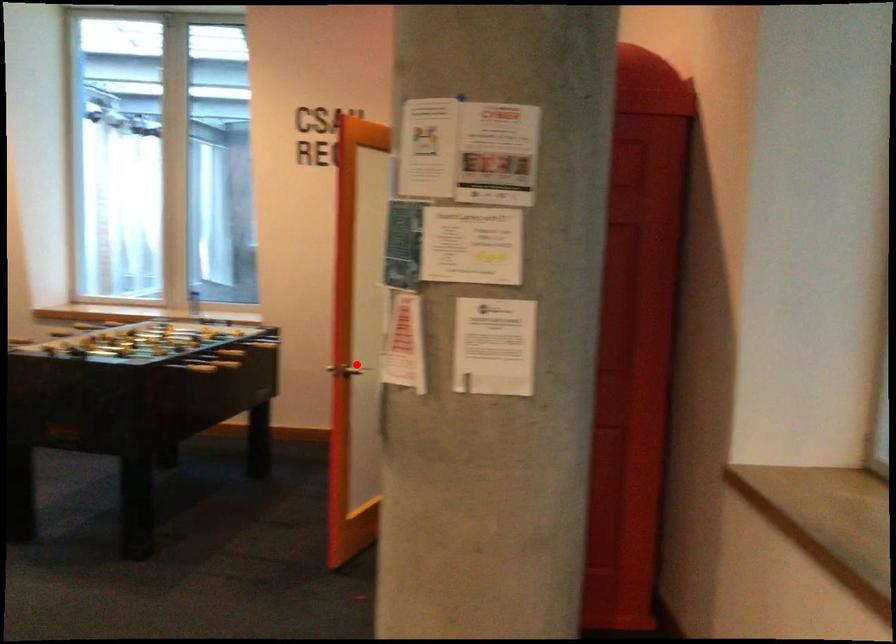
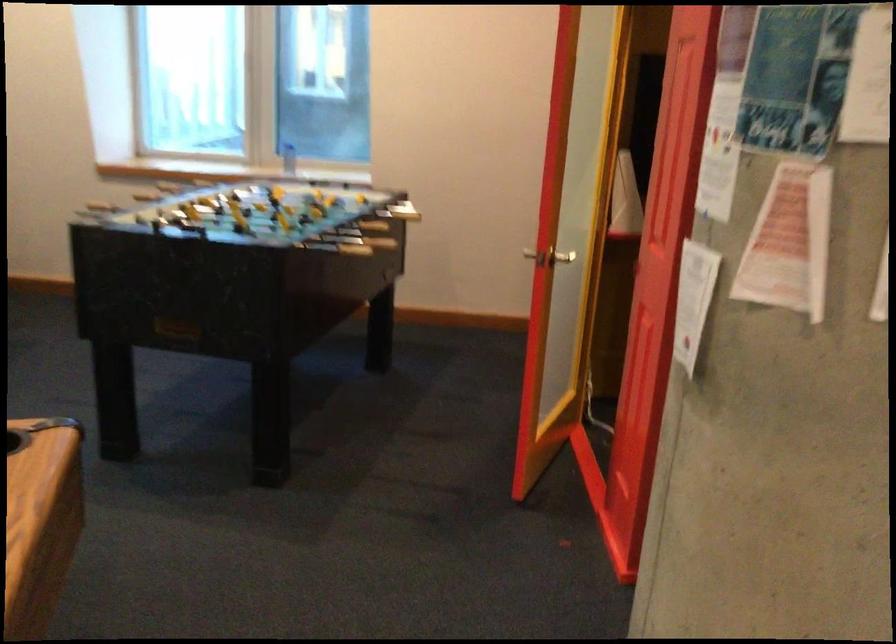
Question: I am providing you with two images of the same scene from different viewpoints. A red point is shown in image1. For the corresponding object point in image2, is it positioned nearer or farther from the camera?

Choices:
 (A) Nearer
 (B) Farther

Answer: (A)